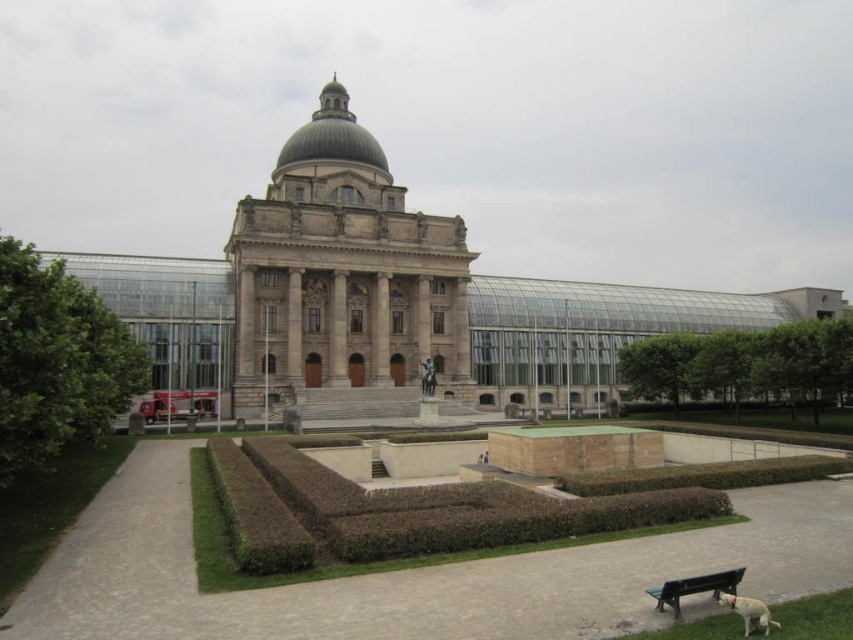
You are a visitor approaching the building and want to sit down to rest. The green leafy hedge at left and the green plastic bench at lower right are both visible. Which one is closer to the entrance?

The green plastic bench at lower right is closer to the entrance since it is to the right of the green leafy hedge at left, which is positioned further away from the entrance on the left side.

You are standing at the entrance of the grand building and see the green leafy hedge at right and the white fur dog at lower right. Which object is closer to you?

The green leafy hedge at right is closer to you because the white fur dog at lower right is behind it.

You are a visitor standing at the entrance of the grand building. You notice the green leafy hedge at left and the green plastic bench at lower right. Which object is taller?

The green leafy hedge at left is taller than the green plastic bench at lower right.